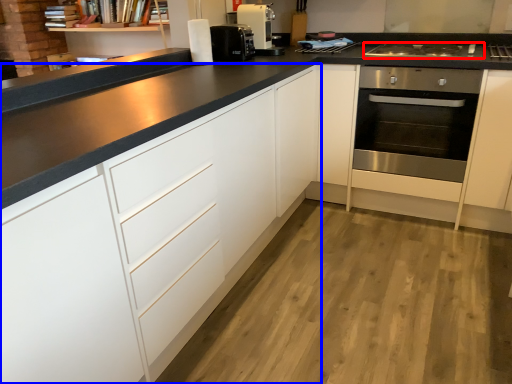
Question: Which of the following is the farthest to the observer, gas stove (highlighted by a red box) or cabinetry (highlighted by a blue box)?

Choices:
 (A) gas stove
 (B) cabinetry

Answer: (A)